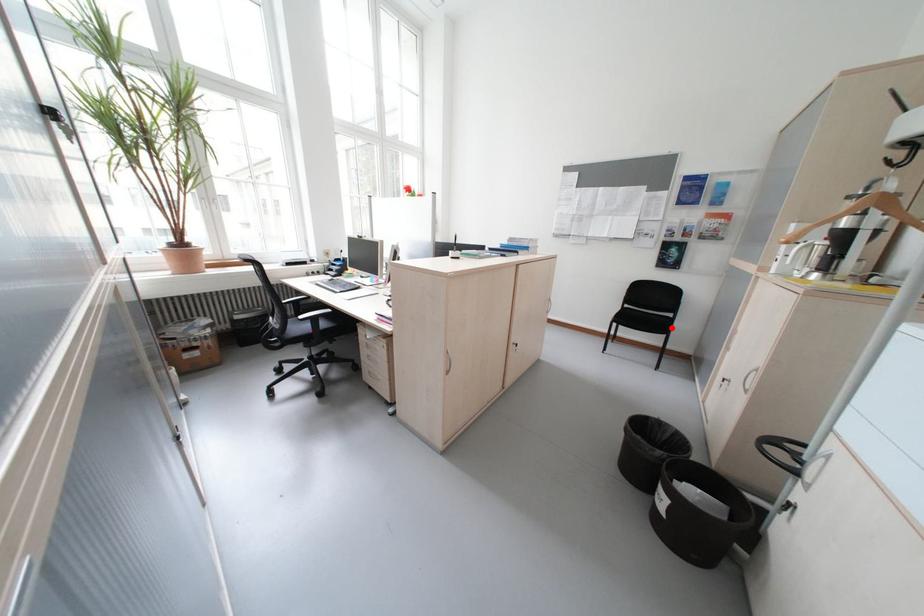
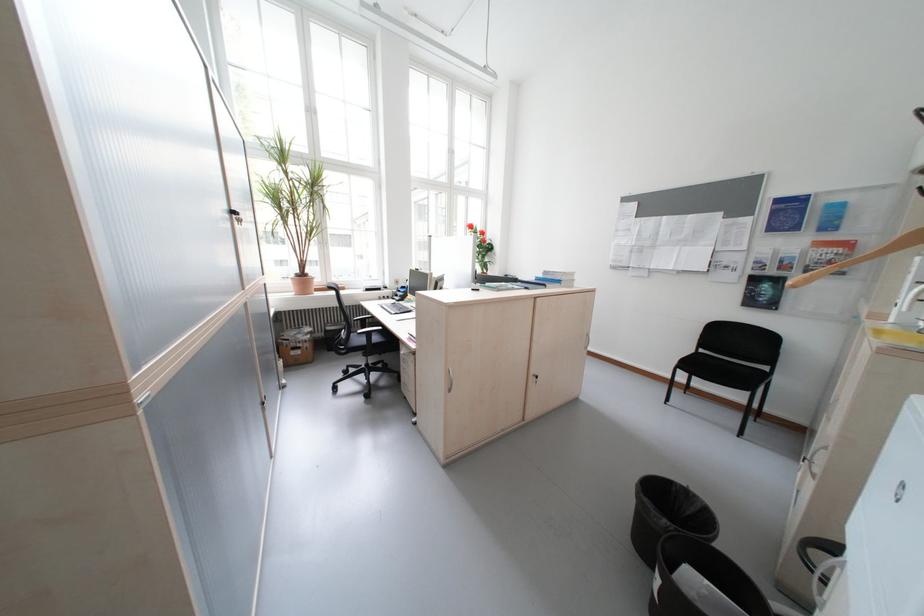
Question: A red point is marked in image1. In image2, is the corresponding 3D point closer to the camera or farther? Reply with the corresponding letter.

Choices:
 (A) The corresponding 3D point is closer.
 (B) The corresponding 3D point is farther.

Answer: (B)